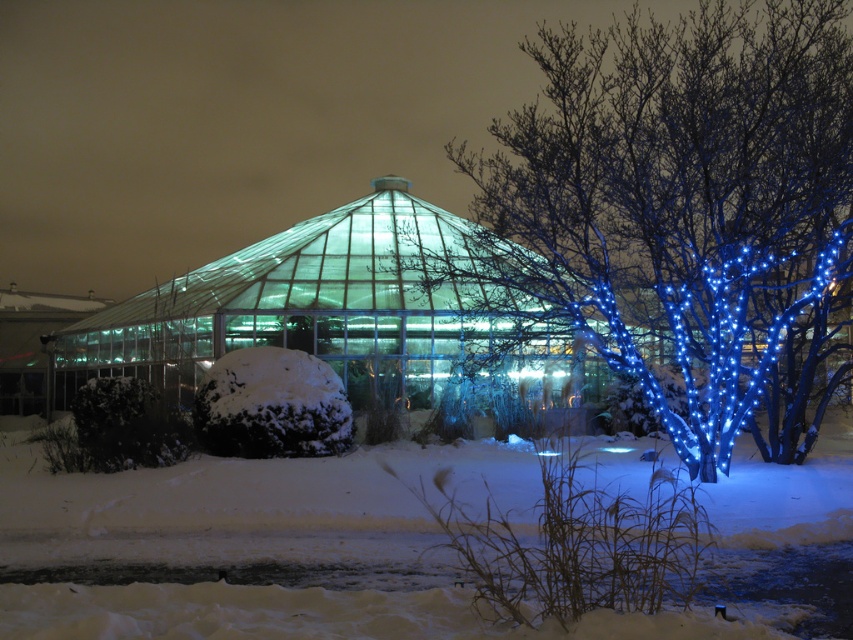
Question: Is blue led-lit branches at center wider than white fluffy snow at lower center?

Choices:
 (A) yes
 (B) no

Answer: (A)

Question: Observing the image, what is the correct spatial positioning of blue led-lit branches at center in reference to white fluffy snow at lower center?

Choices:
 (A) above
 (B) below

Answer: (A)

Question: Among these points, which one is farthest from the camera?

Choices:
 (A) (779, 620)
 (B) (804, 100)

Answer: (B)

Question: Considering the relative positions of blue led-lit branches at center and white fluffy snow at lower center in the image provided, where is blue led-lit branches at center located with respect to white fluffy snow at lower center?

Choices:
 (A) right
 (B) left

Answer: (A)

Question: Which point appears closest to the camera in this image?

Choices:
 (A) (805, 310)
 (B) (379, 461)

Answer: (B)